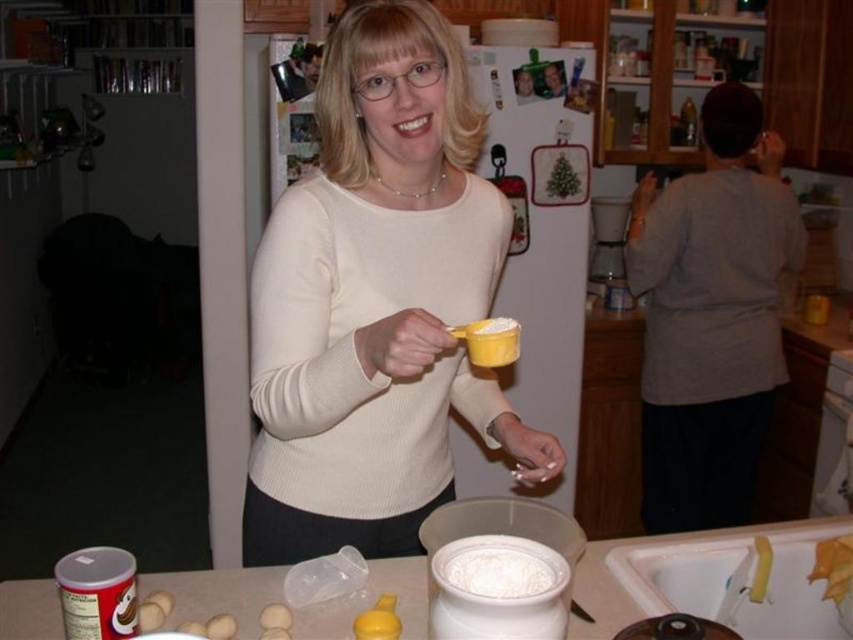
Does white matte sweater at center appear under gray cotton shirt at upper right?

No.

Between white matte sweater at center and gray cotton shirt at upper right, which one has more height?

gray cotton shirt at upper right

Between point (525, 429) and point (732, 488), which one is positioned behind?

Point (732, 488)

Locate an element on the screen. The image size is (853, 640). white matte sweater at center is located at coordinates (376, 301).

Does white matte sweater at center have a larger size compared to white plastic sink at lower right?

Yes.

Is white matte sweater at center positioned in front of white plastic sink at lower right?

Yes, white matte sweater at center is closer to the viewer.

The width and height of the screenshot is (853, 640). Identify the location of white matte sweater at center. (376, 301).

Looking at this image, does gray cotton shirt at upper right have a larger size compared to yellow matte eggs at lower left?

Yes, gray cotton shirt at upper right is bigger than yellow matte eggs at lower left.

Where is `gray cotton shirt at upper right`? gray cotton shirt at upper right is located at coordinates (711, 316).

Where is `gray cotton shirt at upper right`? gray cotton shirt at upper right is located at coordinates (711, 316).

Find the location of `gray cotton shirt at upper right`. gray cotton shirt at upper right is located at coordinates (711, 316).